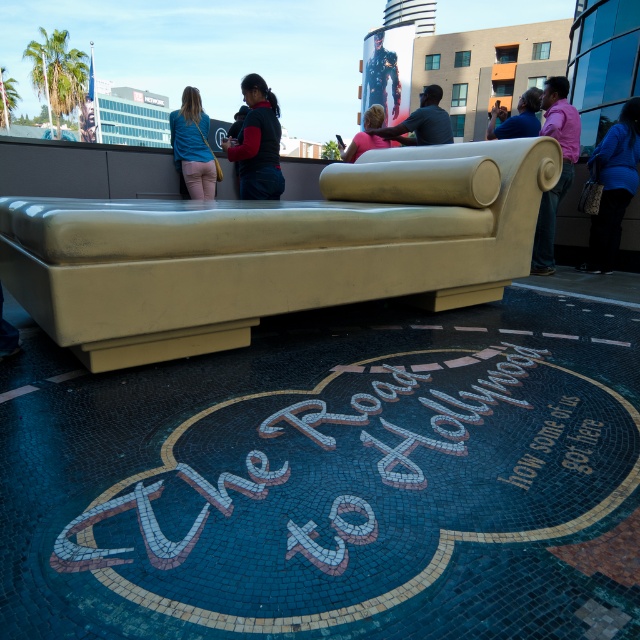
Question: Does beige leather couch at center appear on the left side of pink matte shirt at upper right?

Choices:
 (A) no
 (B) yes

Answer: (B)

Question: Which of the following is the closest to the observer?

Choices:
 (A) pink fabric couch at center
 (B) matte black shirt at center
 (C) beige leather couch at center

Answer: (C)

Question: Which point is closer to the camera?

Choices:
 (A) (560, 198)
 (B) (426, 122)
 (C) (616, 147)

Answer: (C)

Question: From the image, what is the correct spatial relationship of matte black jacket at center in relation to pink fabric couch at center?

Choices:
 (A) left
 (B) right

Answer: (A)

Question: Which point is closer to the camera?

Choices:
 (A) pink fabric couch at center
 (B) beige leather couch at center
 (C) matte black jacket at center
 (D) pink matte shirt at upper right

Answer: (B)

Question: Can you confirm if blue fabric shirt at upper left is smaller than pink fabric couch at center?

Choices:
 (A) yes
 (B) no

Answer: (B)